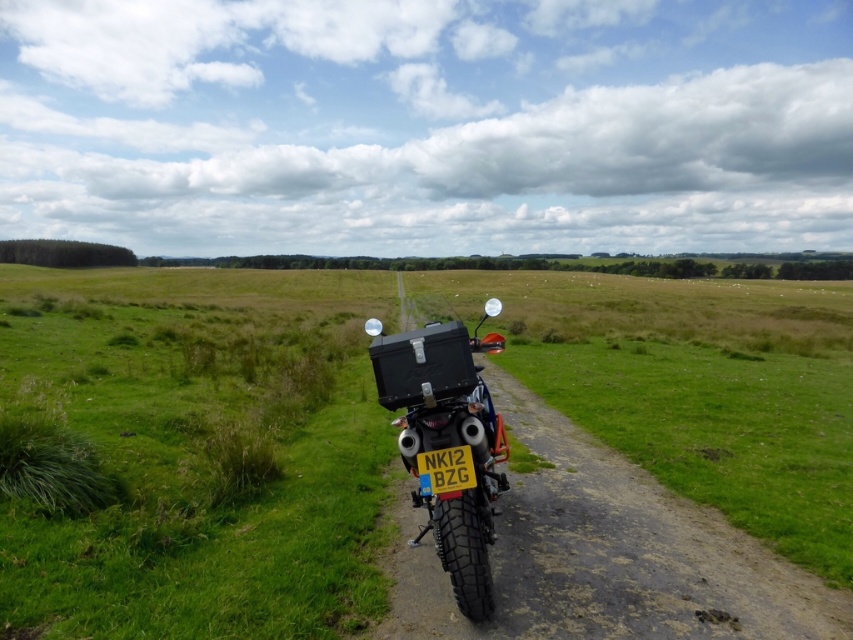
Is point (178, 336) behind point (479, 499)?

Yes, point (178, 336) is farther from viewer.

Who is positioned more to the right, black textured motorcycle at center or matte black motorbike at center?

Positioned to the right is matte black motorbike at center.

Between point (1, 625) and point (437, 435), which one is positioned in front?

Point (1, 625)

At what (x,y) coordinates should I click in order to perform the action: click on black textured motorcycle at center. Please return your answer as a coordinate pair (x, y). The height and width of the screenshot is (640, 853). Looking at the image, I should click on tap(198, 452).

Which is in front, point (409, 416) or point (461, 456)?

Point (461, 456)

Is matte black motorbike at center taller than yellow matte license plate at center?

Yes.

Is point (467, 490) positioned behind point (457, 481)?

Yes, point (467, 490) is farther from viewer.

Find the location of a particular element. Image resolution: width=853 pixels, height=640 pixels. matte black motorbike at center is located at coordinates (447, 442).

Who is higher up, black textured motorcycle at center or yellow matte license plate at center?

Positioned higher is black textured motorcycle at center.

Can you confirm if black textured motorcycle at center is positioned below yellow matte license plate at center?

No, black textured motorcycle at center is not below yellow matte license plate at center.

At what (x,y) coordinates should I click in order to perform the action: click on black textured motorcycle at center. Please return your answer as a coordinate pair (x, y). This screenshot has height=640, width=853. Looking at the image, I should click on (198, 452).

Where is `black textured motorcycle at center`? The image size is (853, 640). black textured motorcycle at center is located at coordinates (198, 452).